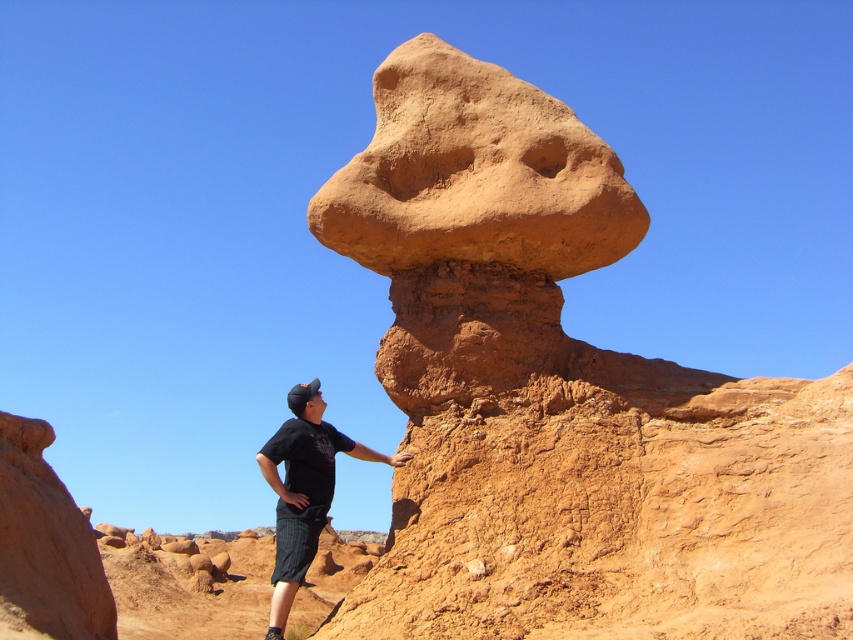
You are standing in the desert and see the rustic sandstone mushroom at center. If you want to walk directly towards it from your current position, what direction should you face?

Since the rustic sandstone mushroom at center is located at coordinates 0.623 on the x and 0.661 on the y axis, you should face towards the center of the image to walk directly towards it.

You are a photographer trying to capture the rustic sandstone mushroom at center and the black cotton shirt at center in your shot. Which object should you focus on first to ensure both are in sharp focus?

You should focus on the rustic sandstone mushroom at center first since it is closer to the viewer than the black cotton shirt at center, ensuring that both will be in focus when using a proper depth of field.

You are planning to take a photo of the rustic sandstone mushroom at center and the black cotton shirt at center. Which object should you zoom in on to capture both in the frame without cropping?

The rustic sandstone mushroom at center is wider than the black cotton shirt at center, so you should zoom in on the black cotton shirt at center to ensure both fit in the frame.